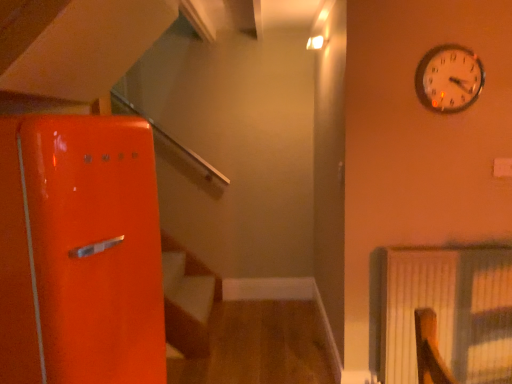
This screenshot has height=384, width=512. What are the coordinates of `white textured radiator at right` in the screenshot? It's located at (448, 311).

Measure the distance between point (459, 278) and camera.

Point (459, 278) is 6.36 feet away from camera.

This screenshot has height=384, width=512. What do you see at coordinates (448, 311) in the screenshot? I see `white textured radiator at right` at bounding box center [448, 311].

In order to click on metallic silver clock at upper right in this screenshot , I will do `click(449, 79)`.

What do you see at coordinates (449, 79) in the screenshot?
I see `metallic silver clock at upper right` at bounding box center [449, 79].

Locate an element on the screen. The width and height of the screenshot is (512, 384). white textured radiator at right is located at coordinates (448, 311).

Considering the relative positions of metallic silver clock at upper right and white textured radiator at right in the image provided, is metallic silver clock at upper right to the left or to the right of white textured radiator at right?

Based on their positions, metallic silver clock at upper right is located to the left of white textured radiator at right.

Consider the image. Is the depth of metallic silver clock at upper right greater than that of white textured radiator at right?

No, it is in front of white textured radiator at right.

Considering the points (450, 60) and (489, 300), which point is in front, point (450, 60) or point (489, 300)?

The point (450, 60) is closer.

From the image's perspective, does metallic silver clock at upper right appear higher than white textured radiator at right?

Yes, from the image's perspective, metallic silver clock at upper right is over white textured radiator at right.

From a real-world perspective, is metallic silver clock at upper right beneath white textured radiator at right?

No, from a real-world perspective, metallic silver clock at upper right is not beneath white textured radiator at right.

Considering the sizes of metallic silver clock at upper right and white textured radiator at right in the image, is metallic silver clock at upper right wider or thinner than white textured radiator at right?

Clearly, metallic silver clock at upper right has less width compared to white textured radiator at right.

Considering the sizes of metallic silver clock at upper right and white textured radiator at right in the image, is metallic silver clock at upper right taller or shorter than white textured radiator at right?

Clearly, metallic silver clock at upper right is shorter compared to white textured radiator at right.

Looking at the image, does metallic silver clock at upper right seem bigger or smaller compared to white textured radiator at right?

Clearly, metallic silver clock at upper right is smaller in size than white textured radiator at right.

Which is correct: metallic silver clock at upper right is inside white textured radiator at right, or outside of it?

metallic silver clock at upper right is spatially situated outside white textured radiator at right.

Is metallic silver clock at upper right with white textured radiator at right?

No, metallic silver clock at upper right is not touching white textured radiator at right.

Is metallic silver clock at upper right looking in the opposite direction of white textured radiator at right?

metallic silver clock at upper right does not have its back to white textured radiator at right.

Identify the location of wall clock above the white textured radiator at right (from a real-world perspective). (449, 79).

Is white textured radiator at right to the left or to the right of metallic silver clock at upper right in the image?

Clearly, white textured radiator at right is on the right of metallic silver clock at upper right in the image.

Does white textured radiator at right come behind metallic silver clock at upper right?

Yes, it is behind metallic silver clock at upper right.

Is point (511, 344) closer to camera compared to point (448, 52)?

That is False.

Looking at this image, from the image's perspective, is white textured radiator at right above metallic silver clock at upper right?

No.

From a real-world perspective, is white textured radiator at right positioned over metallic silver clock at upper right based on gravity?

No, from a real-world perspective, white textured radiator at right is not above metallic silver clock at upper right.

Considering the relative sizes of white textured radiator at right and metallic silver clock at upper right in the image provided, is white textured radiator at right thinner than metallic silver clock at upper right?

Incorrect, the width of white textured radiator at right is not less than that of metallic silver clock at upper right.

Considering the sizes of objects white textured radiator at right and metallic silver clock at upper right in the image provided, who is taller, white textured radiator at right or metallic silver clock at upper right?

Standing taller between the two is white textured radiator at right.

Is white textured radiator at right bigger than metallic silver clock at upper right?

Correct, white textured radiator at right is larger in size than metallic silver clock at upper right.

Is white textured radiator at right positioned beyond the bounds of metallic silver clock at upper right?

Yes, white textured radiator at right is not within metallic silver clock at upper right.

Is white textured radiator at right not near metallic silver clock at upper right?

No, white textured radiator at right is in close proximity to metallic silver clock at upper right.

Is white textured radiator at right looking in the opposite direction of metallic silver clock at upper right?

white textured radiator at right is not turned away from metallic silver clock at upper right.

Based on the photo, measure the distance from white textured radiator at right to metallic silver clock at upper right.

white textured radiator at right is 34.87 inches from metallic silver clock at upper right.

Find the location of a particular element. The height and width of the screenshot is (384, 512). wall clock located on the left of white textured radiator at right is located at coordinates (449, 79).

Locate an element on the screen. radiator on the right of metallic silver clock at upper right is located at coordinates (448, 311).

In the image, there is a metallic silver clock at upper right. Where is `radiator below it (from a real-world perspective)`? radiator below it (from a real-world perspective) is located at coordinates (448, 311).